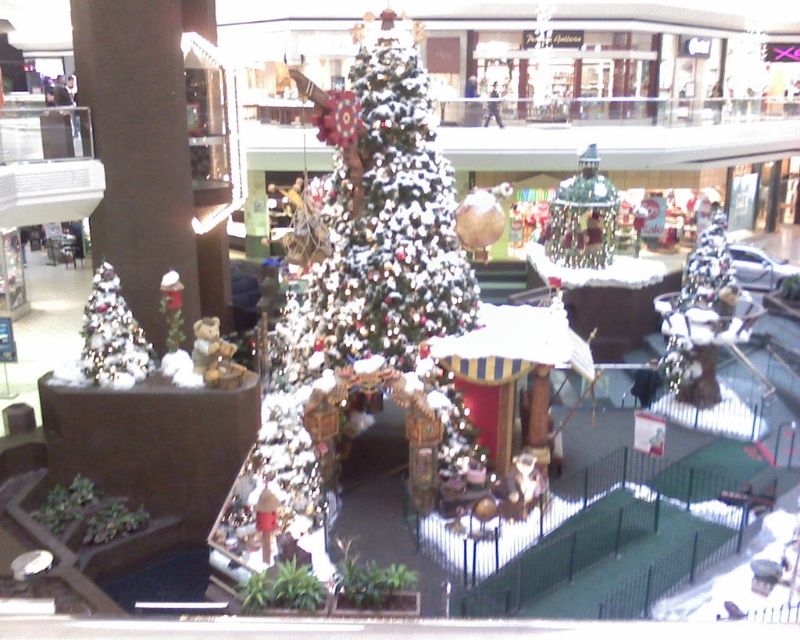
Question: Which point appears farthest from the camera in this image?

Choices:
 (A) (85, 353)
 (B) (574, 188)

Answer: (B)

Question: Which point is closer to the camera taking this photo?

Choices:
 (A) click(100, 381)
 (B) click(590, 156)

Answer: (A)

Question: Does metallic silver ornament at center appear on the right side of white glittery christmas tree at lower left?

Choices:
 (A) no
 (B) yes

Answer: (B)

Question: Observing the image, what is the correct spatial positioning of metallic silver ornament at center in reference to white glittery christmas tree at lower left?

Choices:
 (A) below
 (B) above

Answer: (B)

Question: Is metallic silver ornament at center below white glittery christmas tree at lower left?

Choices:
 (A) no
 (B) yes

Answer: (A)